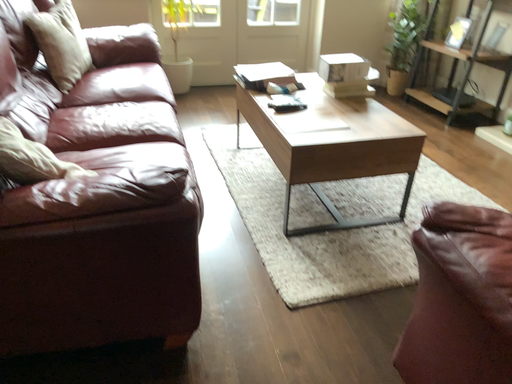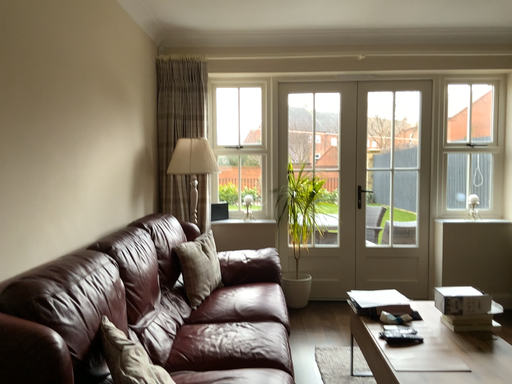
Question: How did the camera likely rotate when shooting the video?

Choices:
 (A) rotated right
 (B) rotated left

Answer: (B)